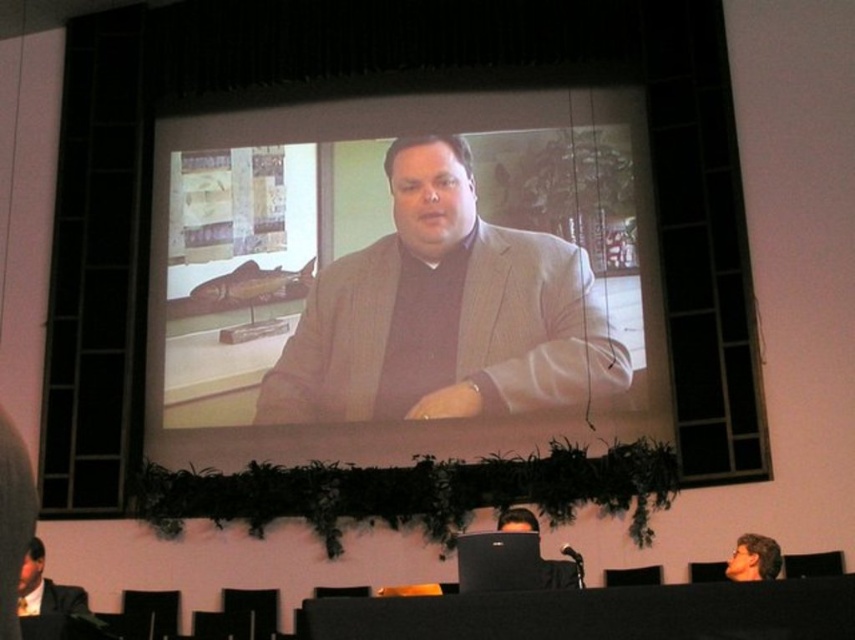
Which is above, matte black suit at lower left or smooth brown hair at lower right?

smooth brown hair at lower right

The width and height of the screenshot is (855, 640). In order to click on matte black suit at lower left in this screenshot , I will do (46, 588).

Where is `matte black suit at lower left`? This screenshot has height=640, width=855. matte black suit at lower left is located at coordinates (46, 588).

Identify the location of matte gray suit at center. (444, 314).

I want to click on matte gray suit at center, so click(x=444, y=314).

Between matte gray suit at center and matte black suit at lower left, which one has more height?

With more height is matte gray suit at center.

Is matte gray suit at center closer to the viewer compared to matte black suit at lower left?

No, it is not.

Describe the element at coordinates (444, 314) in the screenshot. I see `matte gray suit at center` at that location.

This screenshot has width=855, height=640. What are the coordinates of `matte gray suit at center` in the screenshot? It's located at (444, 314).